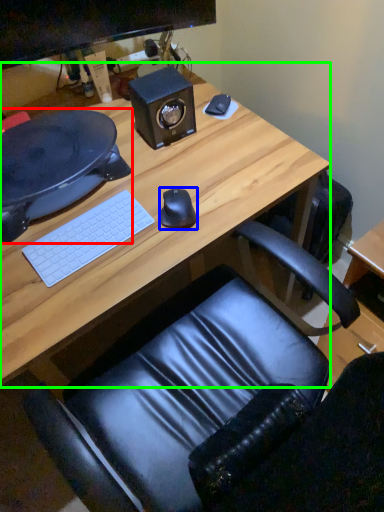
Question: Which object is the closest to the desktop (highlighted by a red box)? Choose among these: mouse (highlighted by a blue box) or desk (highlighted by a green box).

Choices:
 (A) mouse
 (B) desk

Answer: (B)